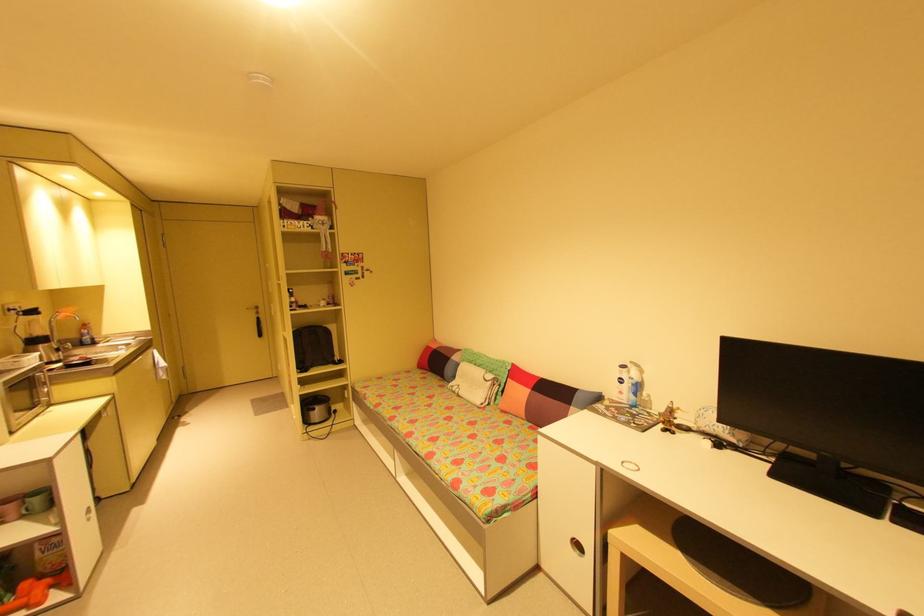
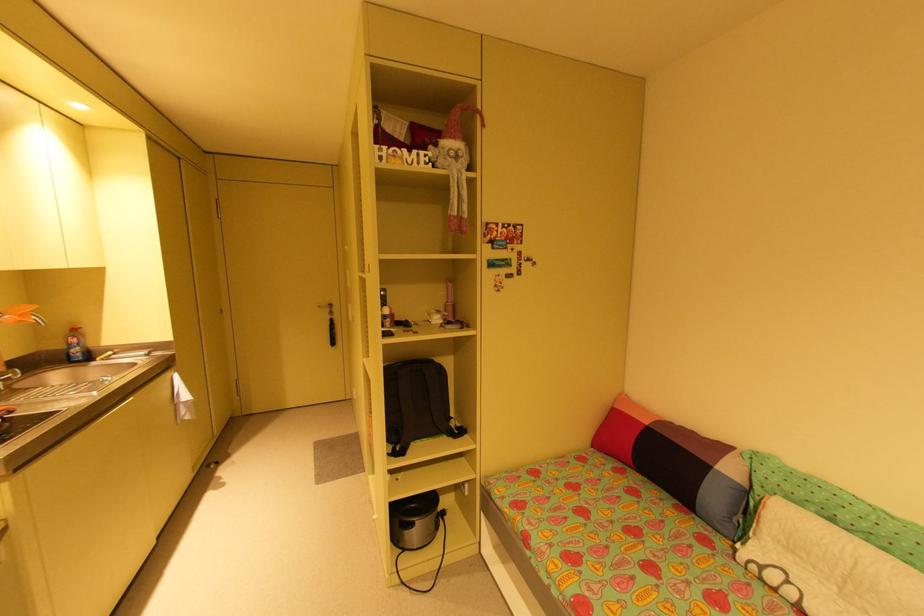
In a continuous first-person perspective shot, in which direction is the camera moving?

The cameraman walked toward left, forward.